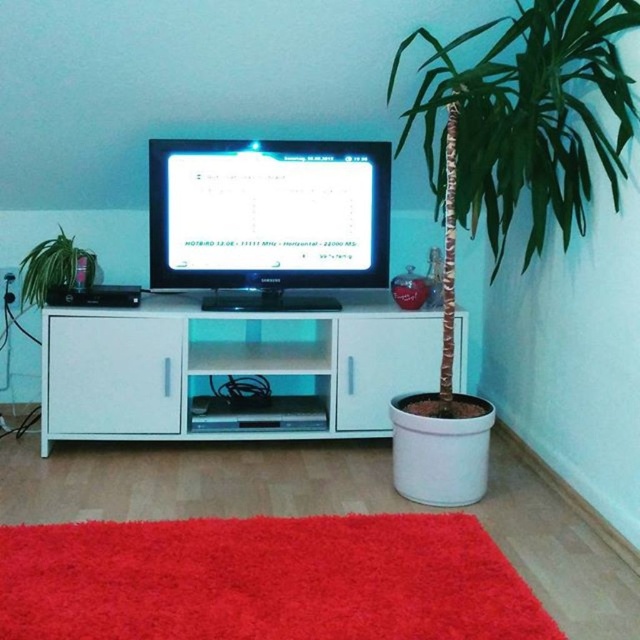
You are standing in the room and want to place a 10 feet long ladder against the white glossy cabinet at center. Is there enough space in front of the cabinet to place the ladder?

The white glossy cabinet at center is 8.65 feet away from the viewer. Since the ladder is 10 feet long, it would extend beyond the cabinet, so there might not be enough space to place the ladder safely without obstruction.

You are setting up a new wireless keyboard that requires a minimum of 30 inches of space between the matte black monitor at center and green matte plant at left to function properly. Based on the scene description, will the keyboard work in this setup?

The distance between the matte black monitor at center and the green matte plant at left is 27.32 inches, which is less than the required 30 inches. Therefore, the keyboard may not function properly due to insufficient space.

You are arranging a new TV setup and want to place a decorative item between the white glossy cabinet at center and the green matte plant at left. Based on their positions, where should you place the item to ensure it is centered between them?

The white glossy cabinet at center is to the right of the green matte plant at left, so placing the decorative item halfway between them would position it to the right of the green matte plant at left and to the left of the white glossy cabinet at center.